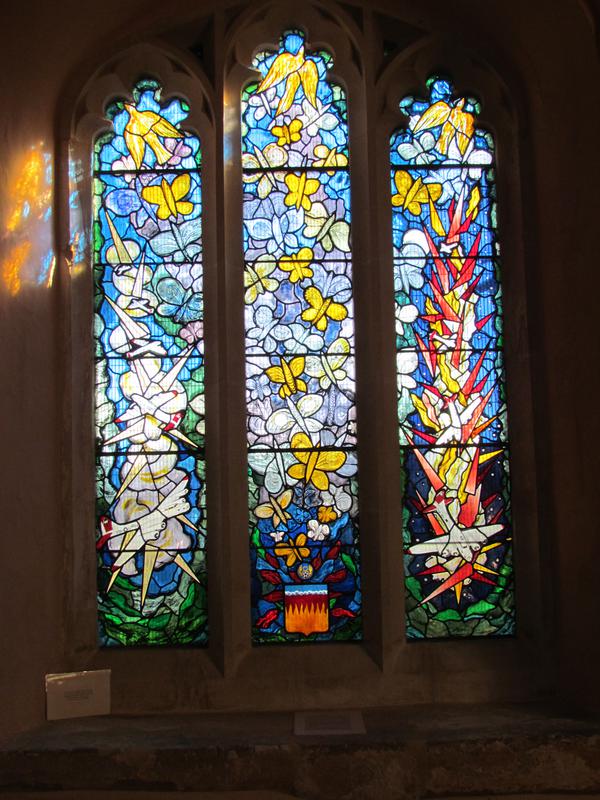
Identify the location of brown window frame. The height and width of the screenshot is (800, 600). (237, 672).